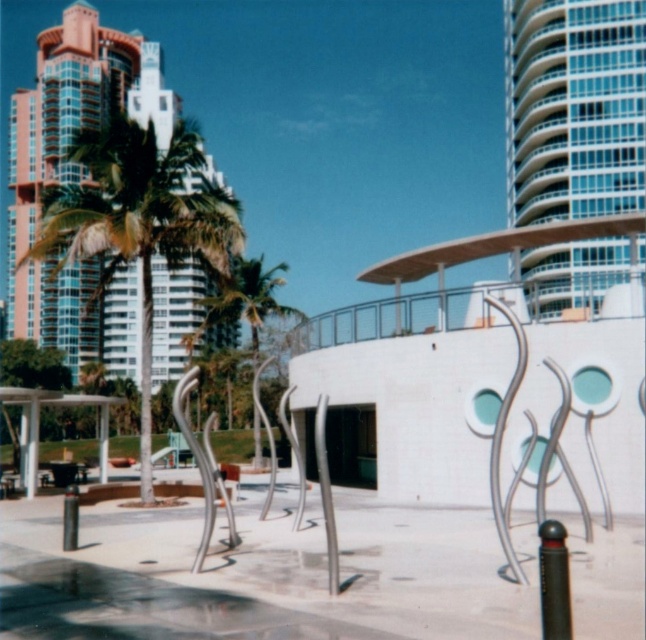
You are a park visitor standing at the entrance of the park and want to find the green leafy palm tree at left and the green leafy palm tree at center. According to the scene description, which palm tree is positioned higher up in the image?

The green leafy palm tree at left is located above the green leafy palm tree at center in the image.

Consider the image. You are standing at the center of the park and want to find the green leafy palm tree at left. According to the coordinates provided, in which direction should you look to see it?

The green leafy palm tree at left is located at coordinates (140, 224), which means it is positioned to the left and slightly forward from the center of the park. You should look to your left and slightly ahead to see it.